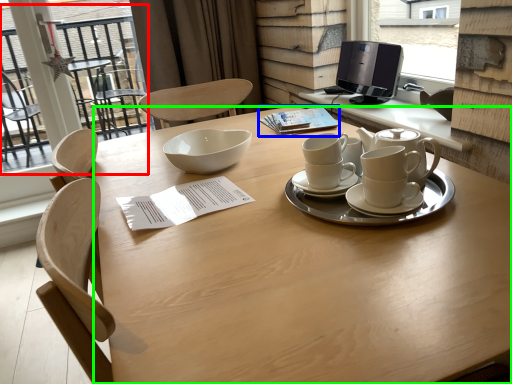
Question: Estimate the real-world distances between objects in this image. Which object is closer to glass door (highlighted by a red box), notepad (highlighted by a blue box) or desk (highlighted by a green box)?

Choices:
 (A) notepad
 (B) desk

Answer: (A)